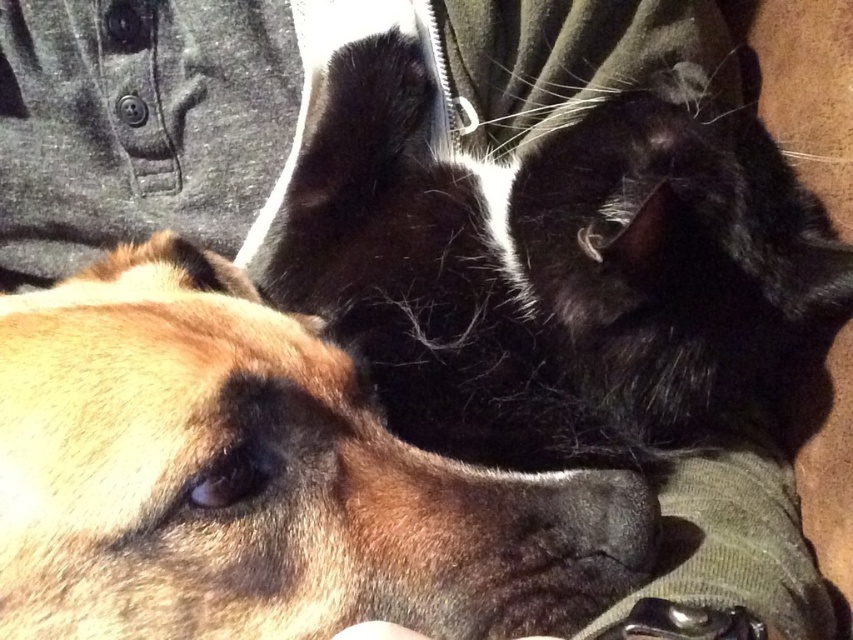
You are a photographer trying to capture a closeup of the black silky fur cat at center and the matte black nose at center. Which one would appear larger in your photo?

The black silky fur cat at center would appear larger in the photo because it is closer to the viewer than the matte black nose at center.

Looking at this image, you are a photographer trying to capture a closeup of the black silky fur cat at center and matte black nose at center. Which one should you focus on if you want to highlight the cat that is positioned to the right?

The black silky fur cat at center is to the right of matte black nose at center, so you should focus on the black silky fur cat at center to highlight the one positioned to the right.

You are standing at point (184,36) and want to walk to point (212,342). Which direction should you move in?

You should move forward to reach point (212,342) from point (184,36) since it is in front of you.